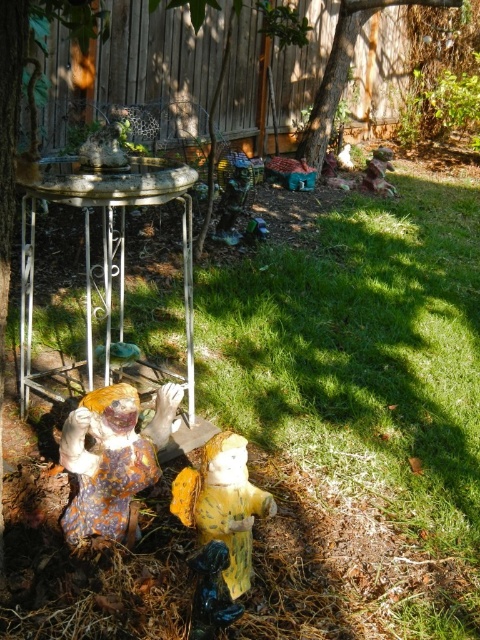
You are standing in the backyard and want to place a new potted plant exactly at the point marked as point (115, 330). If you are currently 3 meters away from that point, how much closer do you need to move to reach it?

The distance of point (115, 330) from viewer is 2.82 meters. Since you are currently 3 meters away, you need to move 0.18 meters closer to reach the point.